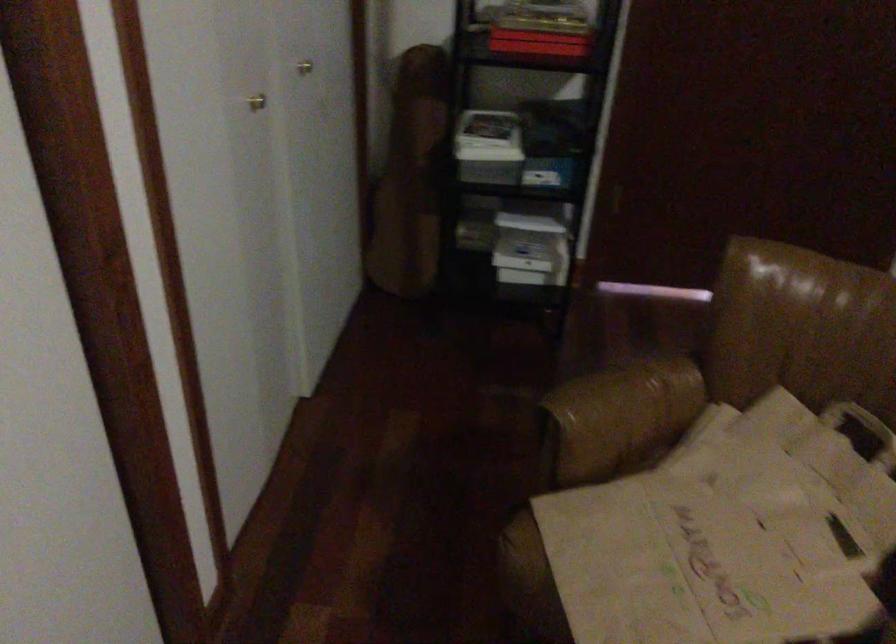
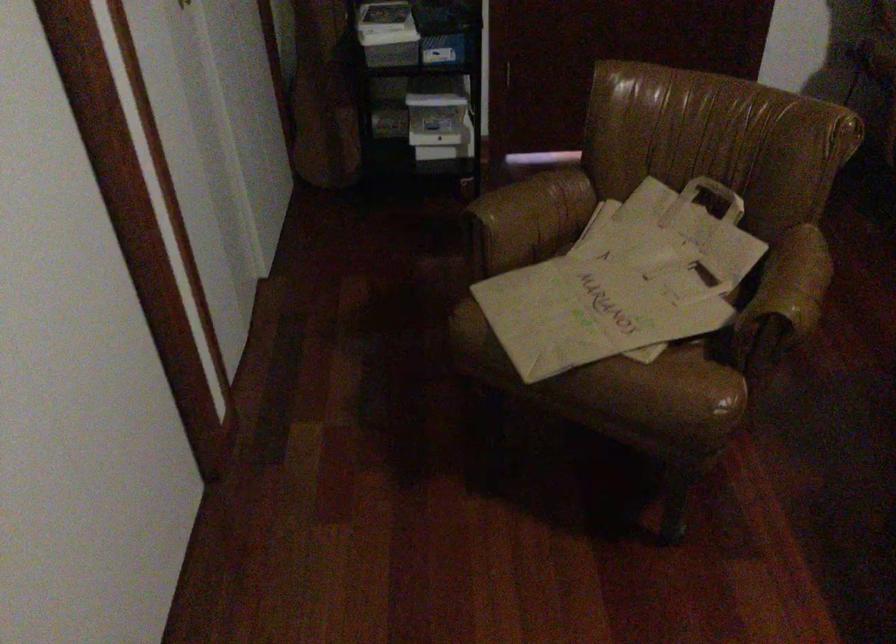
Locate, in the second image, the point that corresponds to [623,422] in the first image.

(532, 216)